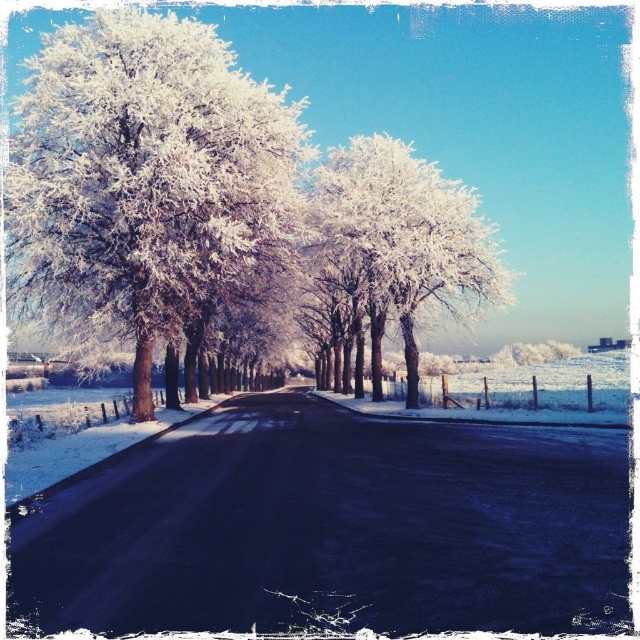
You are standing at the point marked as point (x=145, y=180) in the winter scene. What is the closest object to you?

The closest object to you at point (x=145, y=180) is the frosted white tree at left.

You are an artist planning to paint this winter scene. You want to ensure the frosted white tree at left and the white frosty tree at center are proportionally accurate. Which tree should you paint as larger in your artwork?

The white frosty tree at center should be painted larger because it is larger than the frosted white tree at left.

You are a photographer standing on the road in the winter scene. You want to capture a photo where both the frosted white tree at left and the white frosty tree at center are visible. Based on their positions, which tree is positioned higher in the frame?

The frosted white tree at left is located above the white frosty tree at center, so it is positioned higher in the frame.